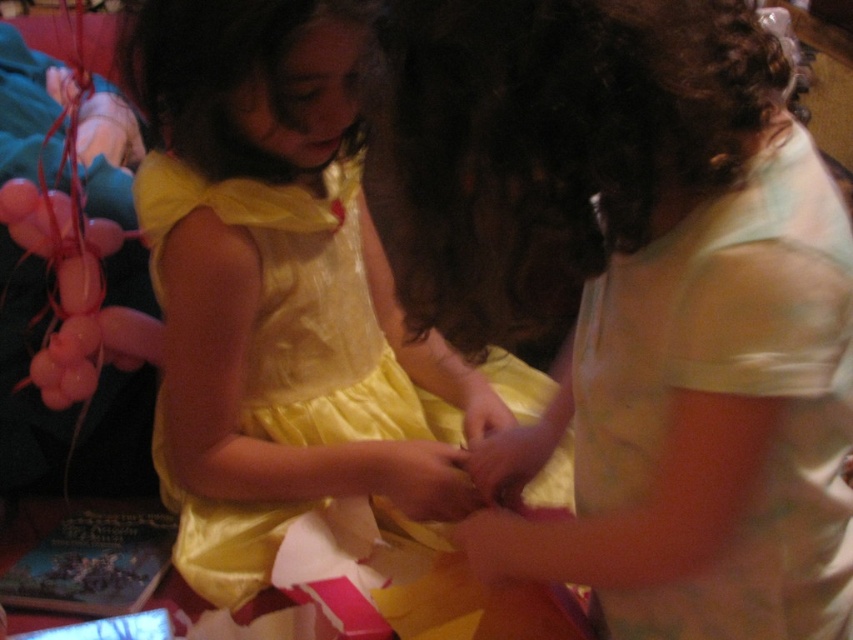
You are taking a photo of the two children in the scene. The first child is at point (x=634, y=557) and the second child is at point (x=415, y=372). Which child will appear larger in your photo?

Point (x=634, y=557) is closer to the camera than point (x=415, y=372), so the first child at point (x=634, y=557) will appear larger in the photo.

You are organizing a costume party and need to decide which outfit to choose between the light green fabric shirt at center and the yellow satin dress at center. Based on their widths, which one is narrower?

The light green fabric shirt at center is narrower than the yellow satin dress at center.

You are a photographer setting up for a photoshoot. You need to ensure that both the light green fabric shirt at center and the yellow satin dress at center are visible in the frame. Based on their positions, which clothing item is closer to the camera?

The light green fabric shirt at center is in front of the yellow satin dress at center, so it is closer to the camera.